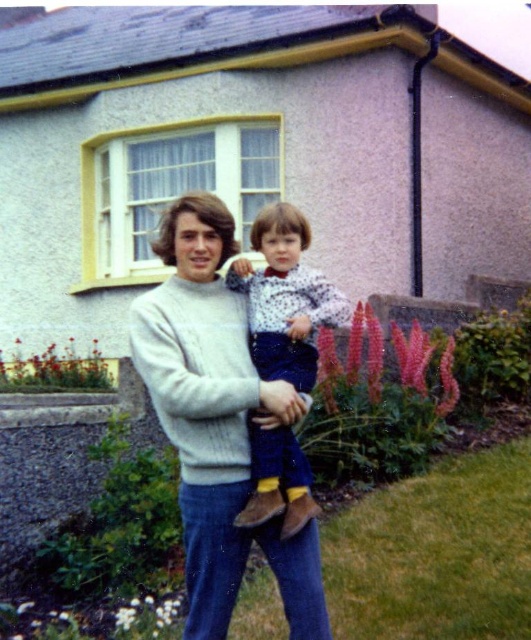
Consider the image. How distant is polka dot sweater at center from pink fuzzy flowers at lower center?

A distance of 9.77 feet exists between polka dot sweater at center and pink fuzzy flowers at lower center.

Find the location of a particular element. The width and height of the screenshot is (531, 640). polka dot sweater at center is located at coordinates [x=286, y=298].

Which of these two, pink fluffy flower at center or white matte flower at lower center, stands taller?

pink fluffy flower at center

Is point (416, 369) closer to camera compared to point (124, 608)?

That is False.

Find the location of a particular element. This screenshot has height=640, width=531. pink fluffy flower at center is located at coordinates (412, 355).

Consider the image. Does knitted sweater at center appear on the left side of vivid pink petals at right?

Indeed, knitted sweater at center is positioned on the left side of vivid pink petals at right.

Who is taller, knitted sweater at center or vivid pink petals at right?

knitted sweater at center is taller.

Where is `knitted sweater at center`? Image resolution: width=531 pixels, height=640 pixels. knitted sweater at center is located at coordinates coord(218,420).